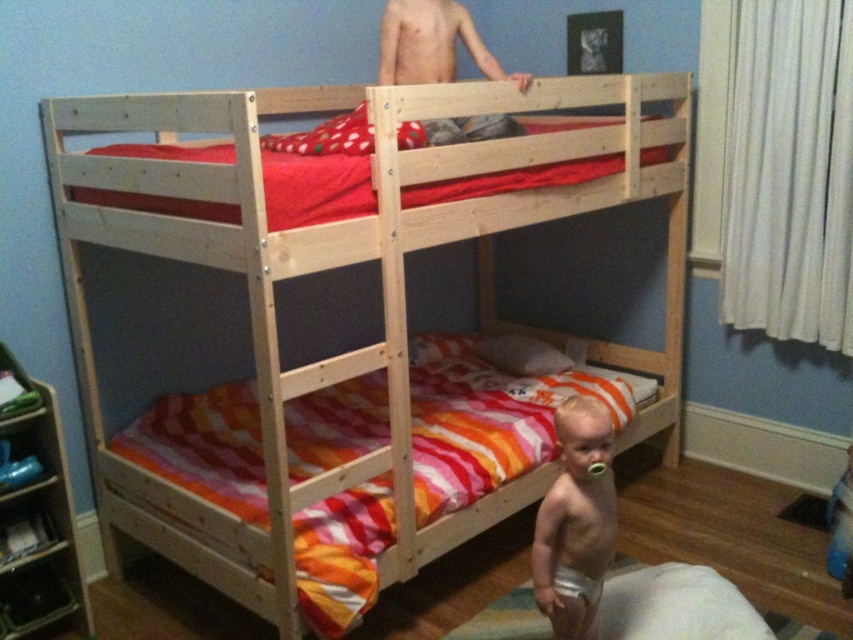
Question: Considering the real-world distances, which object is closest to the natural wood bunk bed at center?

Choices:
 (A) white soft pillow at center
 (B) white cloth diaper at lower center

Answer: (A)

Question: Is natural wood bunk bed at center to the left of white cloth diaper at lower center from the viewer's perspective?

Choices:
 (A) yes
 (B) no

Answer: (A)

Question: Which point is closer to the camera?

Choices:
 (A) (585, 577)
 (B) (590, 460)
 (C) (492, 346)
 (D) (386, 285)

Answer: (B)

Question: Can you confirm if natural wood bunk bed at center is smaller than white cloth diaper at lower center?

Choices:
 (A) yes
 (B) no

Answer: (B)

Question: Considering the relative positions of natural wood bunk bed at center and white soft pillow at center in the image provided, where is natural wood bunk bed at center located with respect to white soft pillow at center?

Choices:
 (A) below
 (B) above

Answer: (B)

Question: Based on their relative distances, which object is farther from the natural wood bunk bed at center?

Choices:
 (A) white soft pillow at center
 (B) smooth beige baby at center
 (C) white cloth diaper at lower center

Answer: (C)